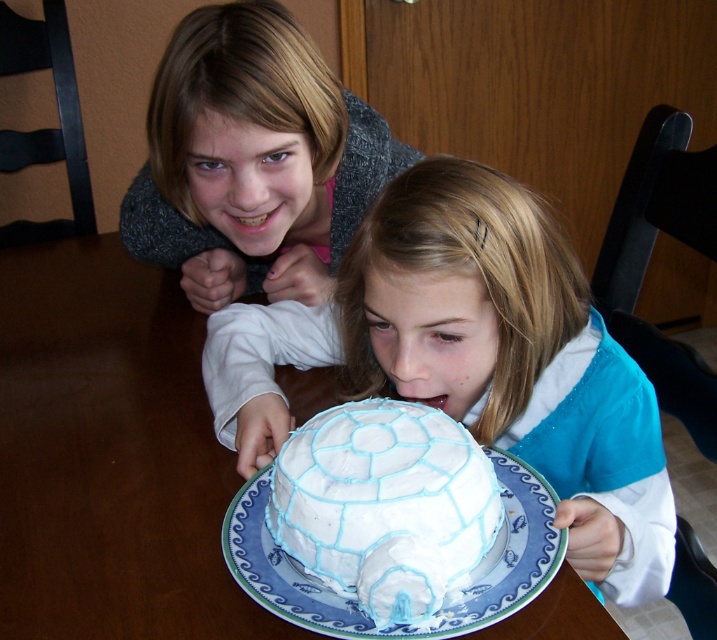
Question: Can you confirm if white glossy cake at center is positioned above white frosting igloo at center?

Choices:
 (A) yes
 (B) no

Answer: (A)

Question: Based on their relative distances, which object is nearer to the white glossy cake at center?

Choices:
 (A) white frosting igloo at center
 (B) matte gray sweater at upper left

Answer: (A)

Question: Considering the real-world distances, which object is closest to the white frosting igloo at center?

Choices:
 (A) matte gray sweater at upper left
 (B) white glossy cake at center

Answer: (B)

Question: Among these objects, which one is nearest to the camera?

Choices:
 (A) matte gray sweater at upper left
 (B) white frosting igloo at center
 (C) white glossy cake at center

Answer: (B)

Question: Is matte gray sweater at upper left smaller than white frosting igloo at center?

Choices:
 (A) yes
 (B) no

Answer: (B)

Question: Is white glossy cake at center above matte gray sweater at upper left?

Choices:
 (A) no
 (B) yes

Answer: (A)